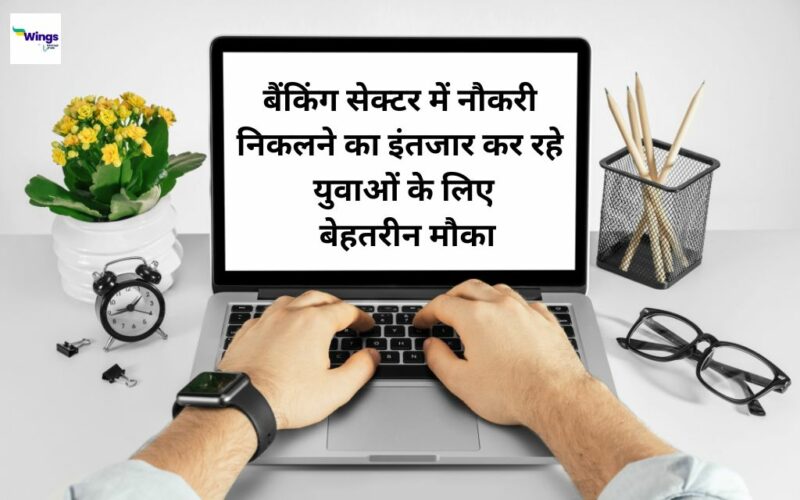
I want to click on black metal pencil holder, so click(664, 211).